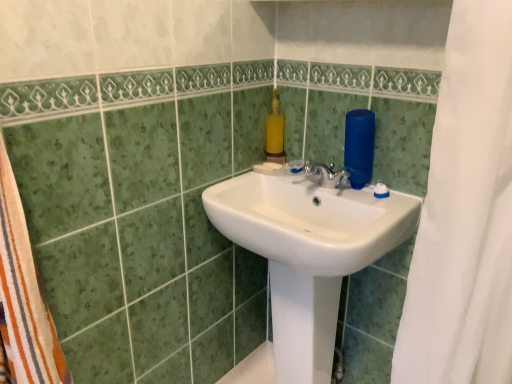
Question: From their relative heights in the image, would you say yellow matte soap dispenser at upper center is taller or shorter than white glossy sink at center?

Choices:
 (A) tall
 (B) short

Answer: (B)

Question: From a real-world perspective, is yellow matte soap dispenser at upper center above or below white glossy sink at center?

Choices:
 (A) below
 (B) above

Answer: (B)

Question: From the image's perspective, relative to white glossy sink at center, is yellow matte soap dispenser at upper center above or below?

Choices:
 (A) above
 (B) below

Answer: (A)

Question: Is point (332, 269) closer or farther from the camera than point (274, 152)?

Choices:
 (A) closer
 (B) farther

Answer: (A)

Question: Based on their sizes in the image, would you say white glossy sink at center is bigger or smaller than yellow matte soap dispenser at upper center?

Choices:
 (A) big
 (B) small

Answer: (A)

Question: From the image's perspective, is white glossy sink at center positioned above or below yellow matte soap dispenser at upper center?

Choices:
 (A) below
 (B) above

Answer: (A)

Question: In terms of width, does white glossy sink at center look wider or thinner when compared to yellow matte soap dispenser at upper center?

Choices:
 (A) wide
 (B) thin

Answer: (A)